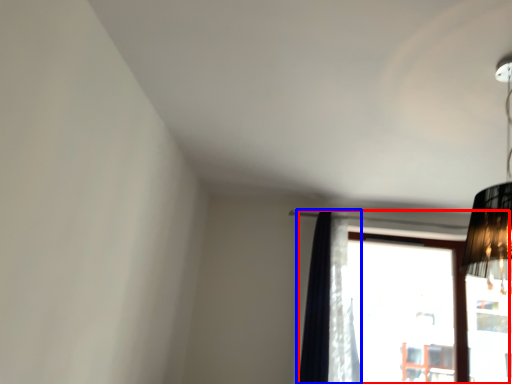
Question: Which object appears farthest to the camera in this image, window (highlighted by a red box) or curtain (highlighted by a blue box)?

Choices:
 (A) window
 (B) curtain

Answer: (A)